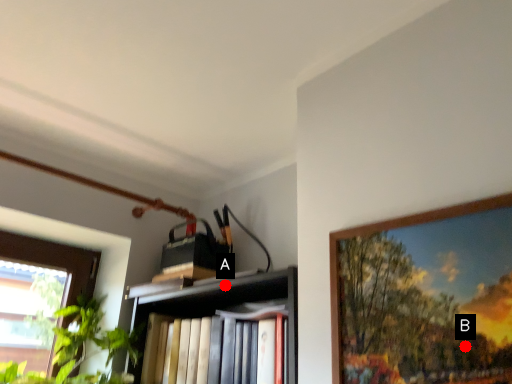
Question: Two points are circled on the image, labeled by A and B beside each circle. Which of the following is the closest to the observer?

Choices:
 (A) A is closer
 (B) B is closer

Answer: (B)